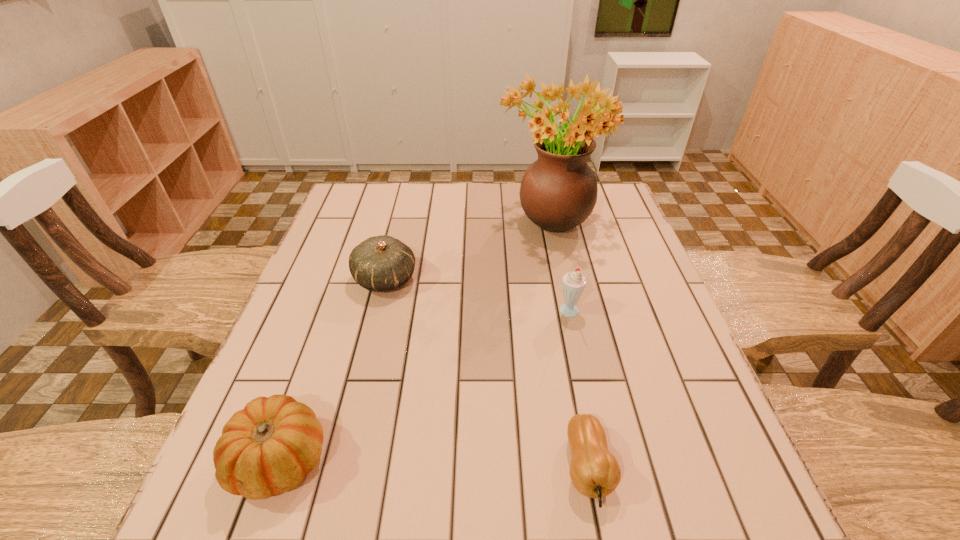
Find the location of a particular element. free spot located on the straw side of the third nearest object is located at coordinates (507, 313).

Where is `vacant region located 0.150m on the back of the farthest gourd`? This screenshot has width=960, height=540. vacant region located 0.150m on the back of the farthest gourd is located at coordinates (397, 228).

Where is `object positioned at the far edge`? object positioned at the far edge is located at coordinates (558, 192).

The image size is (960, 540). In order to click on object at the right edge in this screenshot , I will do `click(558, 192)`.

Identify the location of object that is at the near left corner. This screenshot has width=960, height=540. [267, 448].

Image resolution: width=960 pixels, height=540 pixels. I want to click on object situated at the far right corner, so click(558, 192).

In the image, there is a desktop. Identify the location of vacant region at the far edge. The width and height of the screenshot is (960, 540). (494, 190).

What are the coordinates of `free space at the near edge of the desktop` in the screenshot? It's located at (458, 539).

The image size is (960, 540). Find the location of `vacant space at the left edge of the desktop`. vacant space at the left edge of the desktop is located at coordinates (x=271, y=382).

Locate an element on the screen. The height and width of the screenshot is (540, 960). blank space at the right edge of the desktop is located at coordinates (648, 293).